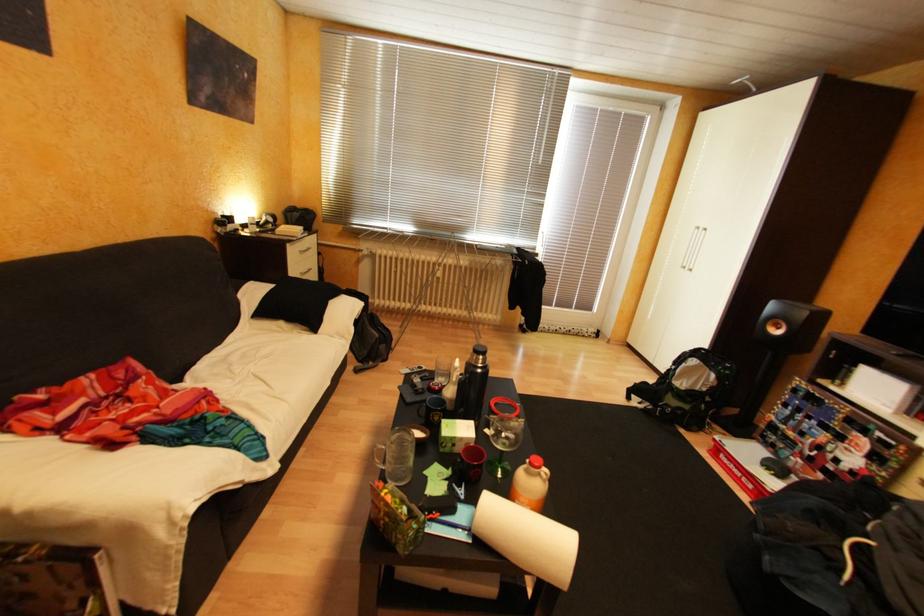
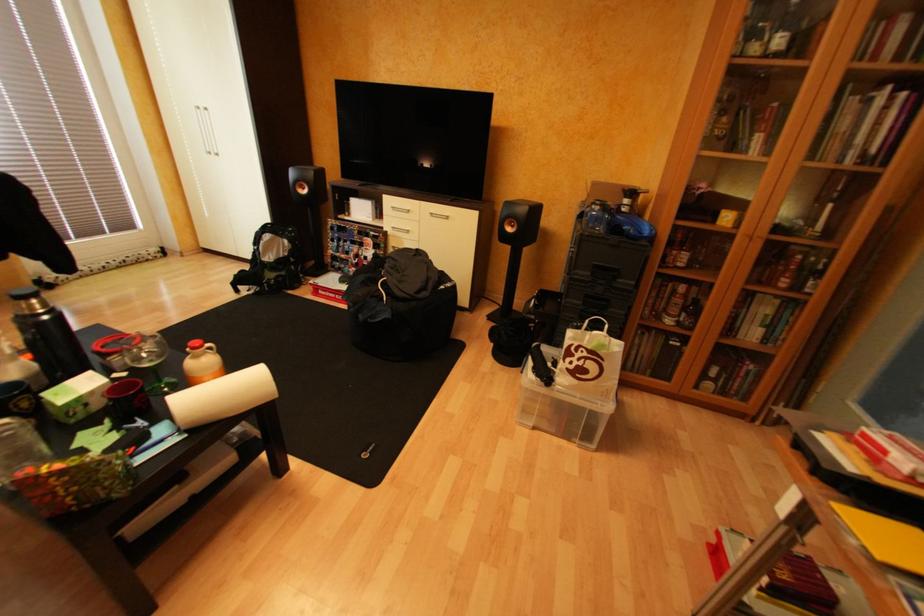
How did the camera likely rotate?

The camera's rotation is toward right-down.